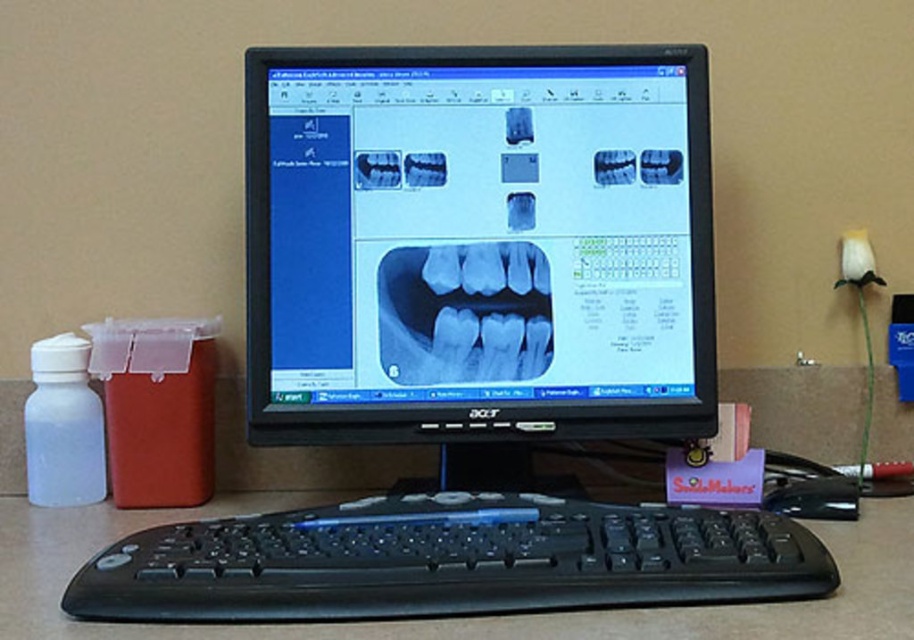
Question: Can you confirm if blue x-ray film at center is wider than black plastic mouse at lower right?

Choices:
 (A) no
 (B) yes

Answer: (B)

Question: Does matte black monitor at center come in front of black plastic keyboard at center?

Choices:
 (A) yes
 (B) no

Answer: (B)

Question: Which point is closer to the camera taking this photo?

Choices:
 (A) (498, 144)
 (B) (344, 570)
 (C) (57, 424)
 (D) (848, 506)

Answer: (B)

Question: Does matte black monitor at center appear on the right side of blue x-ray film at center?

Choices:
 (A) yes
 (B) no

Answer: (A)

Question: Which object is closer to the camera taking this photo?

Choices:
 (A) matte black monitor at center
 (B) blue x-ray film at center
 (C) transparent plastic bottle at left
 (D) black plastic keyboard at center

Answer: (D)

Question: Among these objects, which one is farthest from the camera?

Choices:
 (A) black plastic mouse at lower right
 (B) blue x-ray film at center
 (C) transparent plastic bottle at left

Answer: (C)